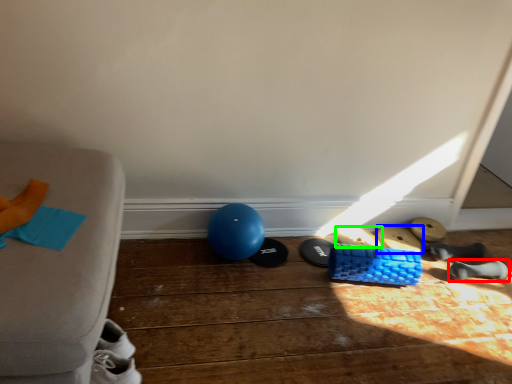
Question: Which object is positioned farthest from footwear (highlighted by a red box)? Select from footwear (highlighted by a blue box) and footwear (highlighted by a green box).

Choices:
 (A) footwear
 (B) footwear

Answer: (B)